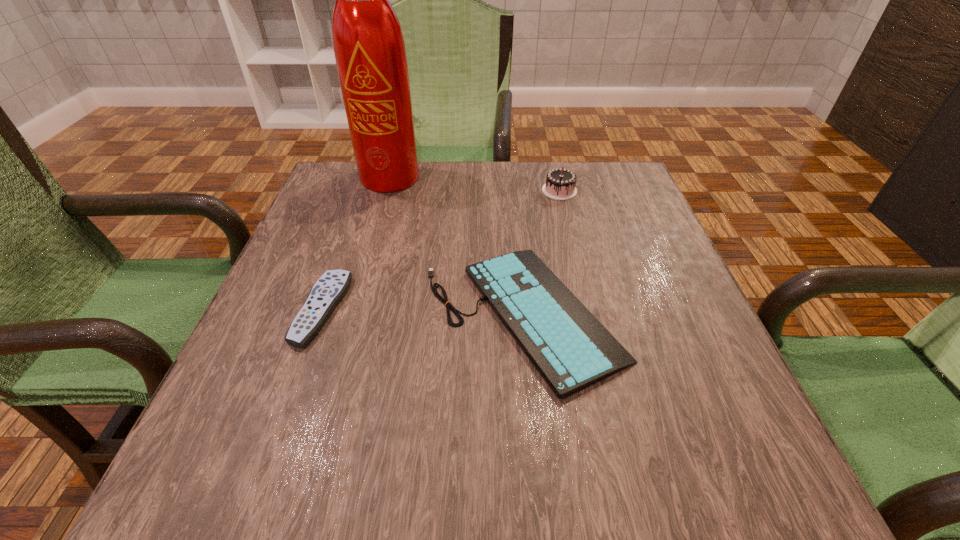
Locate an element on the screen. free region at the near right corner is located at coordinates (775, 458).

Locate an element on the screen. The height and width of the screenshot is (540, 960). free point between the fire extinguisher and the chocolate cake is located at coordinates (477, 184).

Identify the location of vacant region between the fire extinguisher and the second tallest object. (477, 184).

Find the location of `vacant space in between the remote control and the chocolate cake`. vacant space in between the remote control and the chocolate cake is located at coordinates (441, 250).

Identify the location of empty space between the third shortest object and the computer keyboard. Image resolution: width=960 pixels, height=540 pixels. (541, 252).

Find the location of `empty location between the chocolate cake and the fire extinguisher`. empty location between the chocolate cake and the fire extinguisher is located at coordinates click(477, 184).

Find the location of a particular element. This screenshot has width=960, height=540. empty space between the remote control and the chocolate cake is located at coordinates (441, 250).

I want to click on empty space that is in between the tallest object and the computer keyboard, so click(x=458, y=246).

Locate an element on the screen. This screenshot has height=540, width=960. blank region between the computer keyboard and the second tallest object is located at coordinates (541, 252).

At what (x,y) coordinates should I click in order to perform the action: click on free spot between the third shortest object and the computer keyboard. Please return your answer as a coordinate pair (x, y). Looking at the image, I should click on point(541,252).